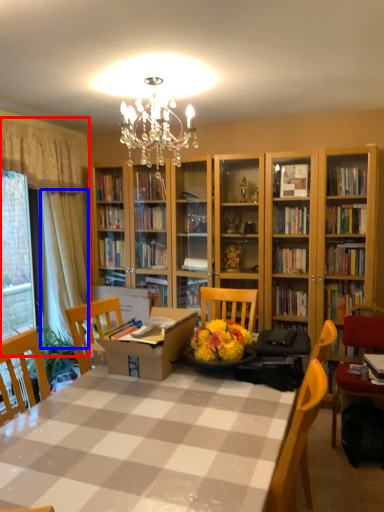
Question: Which point is further to the camera, curtain (highlighted by a red box) or curtain (highlighted by a blue box)?

Choices:
 (A) curtain
 (B) curtain

Answer: (B)